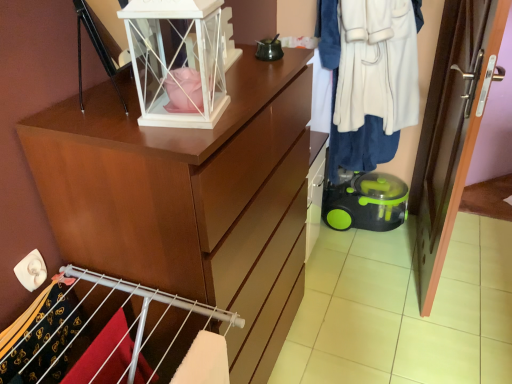
The image size is (512, 384). What do you see at coordinates (367, 203) in the screenshot? I see `green plastic vacuum cleaner at lower right` at bounding box center [367, 203].

I want to click on green plastic vacuum cleaner at lower right, so click(367, 203).

What do you see at coordinates (369, 77) in the screenshot? I see `white plush coat at right` at bounding box center [369, 77].

Identify the location of white plush coat at right. This screenshot has width=512, height=384. (369, 77).

The width and height of the screenshot is (512, 384). I want to click on green plastic vacuum cleaner at lower right, so (x=367, y=203).

Based on their positions, is white plush coat at right located to the left or right of green plastic vacuum cleaner at lower right?

white plush coat at right is positioned on green plastic vacuum cleaner at lower right's left side.

Is white plush coat at right positioned in front of green plastic vacuum cleaner at lower right?

Yes, it is in front of green plastic vacuum cleaner at lower right.

Between point (333, 22) and point (348, 209), which one is positioned behind?

The point (348, 209) is farther from the camera.

From the image's perspective, would you say white plush coat at right is positioned over green plastic vacuum cleaner at lower right?

Indeed, from the image's perspective, white plush coat at right is shown above green plastic vacuum cleaner at lower right.

From a real-world perspective, between white plush coat at right and green plastic vacuum cleaner at lower right, who is vertically higher?

white plush coat at right.

Considering the sizes of white plush coat at right and green plastic vacuum cleaner at lower right in the image, is white plush coat at right wider or thinner than green plastic vacuum cleaner at lower right?

In the image, white plush coat at right appears to be wider than green plastic vacuum cleaner at lower right.

Between white plush coat at right and green plastic vacuum cleaner at lower right, which one has more height?

white plush coat at right is taller.

Is white plush coat at right smaller than green plastic vacuum cleaner at lower right?

No, white plush coat at right is not smaller than green plastic vacuum cleaner at lower right.

Which is correct: white plush coat at right is inside green plastic vacuum cleaner at lower right, or outside of it?

The correct answer is: outside.

Is white plush coat at right not close to green plastic vacuum cleaner at lower right?

Actually, white plush coat at right and green plastic vacuum cleaner at lower right are a little close together.

Is white plush coat at right oriented towards green plastic vacuum cleaner at lower right?

No, white plush coat at right does not turn towards green plastic vacuum cleaner at lower right.

How many degrees apart are the facing directions of white plush coat at right and green plastic vacuum cleaner at lower right?

The angle between the facing direction of white plush coat at right and the facing direction of green plastic vacuum cleaner at lower right is 5.59e-05 degrees.

What are the coordinates of `toy below the white plush coat at right (from the image's perspective)` in the screenshot? It's located at (367, 203).

Considering the relative positions of green plastic vacuum cleaner at lower right and white plush coat at right in the image provided, is green plastic vacuum cleaner at lower right to the right of white plush coat at right from the viewer's perspective?

Yes, green plastic vacuum cleaner at lower right is to the right of white plush coat at right.

Which is in front, green plastic vacuum cleaner at lower right or white plush coat at right?

white plush coat at right is more forward.

Does point (406, 199) come behind point (334, 143)?

Yes, point (406, 199) is farther from viewer.

From the image's perspective, which is below, green plastic vacuum cleaner at lower right or white plush coat at right?

green plastic vacuum cleaner at lower right.

From a real-world perspective, is green plastic vacuum cleaner at lower right beneath white plush coat at right?

Correct, in the physical world, green plastic vacuum cleaner at lower right is lower than white plush coat at right.

Between green plastic vacuum cleaner at lower right and white plush coat at right, which one has smaller width?

green plastic vacuum cleaner at lower right is thinner.

Considering the sizes of green plastic vacuum cleaner at lower right and white plush coat at right in the image, is green plastic vacuum cleaner at lower right taller or shorter than white plush coat at right?

green plastic vacuum cleaner at lower right is shorter than white plush coat at right.

Considering the sizes of green plastic vacuum cleaner at lower right and white plush coat at right in the image, is green plastic vacuum cleaner at lower right bigger or smaller than white plush coat at right?

green plastic vacuum cleaner at lower right is smaller than white plush coat at right.

Is green plastic vacuum cleaner at lower right inside the boundaries of white plush coat at right, or outside?

green plastic vacuum cleaner at lower right exists outside the volume of white plush coat at right.

Is green plastic vacuum cleaner at lower right in contact with white plush coat at right?

No, green plastic vacuum cleaner at lower right is not with white plush coat at right.

Is green plastic vacuum cleaner at lower right turned away from white plush coat at right?

That's not correct — green plastic vacuum cleaner at lower right is not looking away from white plush coat at right.

Can you tell me how much green plastic vacuum cleaner at lower right and white plush coat at right differ in facing direction?

5.59e-05 degrees separate the facing orientations of green plastic vacuum cleaner at lower right and white plush coat at right.

This screenshot has height=384, width=512. In order to click on clothing in front of the green plastic vacuum cleaner at lower right in this screenshot , I will do `click(369, 77)`.

This screenshot has width=512, height=384. I want to click on clothing to the left of green plastic vacuum cleaner at lower right, so click(x=369, y=77).

Locate an element on the screen. The height and width of the screenshot is (384, 512). toy behind the white plush coat at right is located at coordinates pos(367,203).